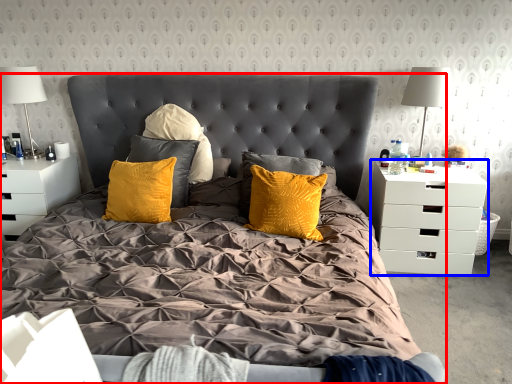
Question: Which object is further to the camera taking this photo, bed (highlighted by a red box) or nightstand (highlighted by a blue box)?

Choices:
 (A) bed
 (B) nightstand

Answer: (B)